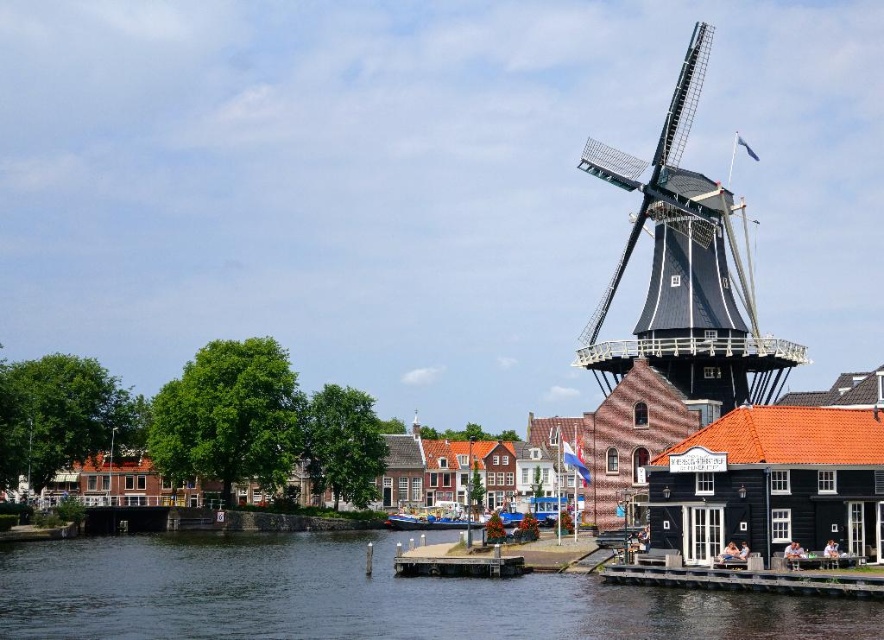
Question: From the image, what is the correct spatial relationship of dark brown wooden windmill at right in relation to blue wooden boat at center?

Choices:
 (A) above
 (B) below

Answer: (A)

Question: Which object is farther from the camera taking this photo?

Choices:
 (A) dark brown wooden windmill at right
 (B) dark blue water at lower left
 (C) blue wooden boat at center

Answer: (C)

Question: Does dark blue water at lower left have a larger size compared to dark brown wooden windmill at right?

Choices:
 (A) no
 (B) yes

Answer: (A)

Question: Which object is the closest to the dark blue water at lower left?

Choices:
 (A) dark brown wooden windmill at right
 (B) blue wooden boat at center

Answer: (A)

Question: Which point is farther from the camera taking this photo?

Choices:
 (A) 490,593
 (B) 405,524
 (C) 668,289

Answer: (B)

Question: Does dark blue water at lower left appear over blue wooden boat at center?

Choices:
 (A) yes
 (B) no

Answer: (A)